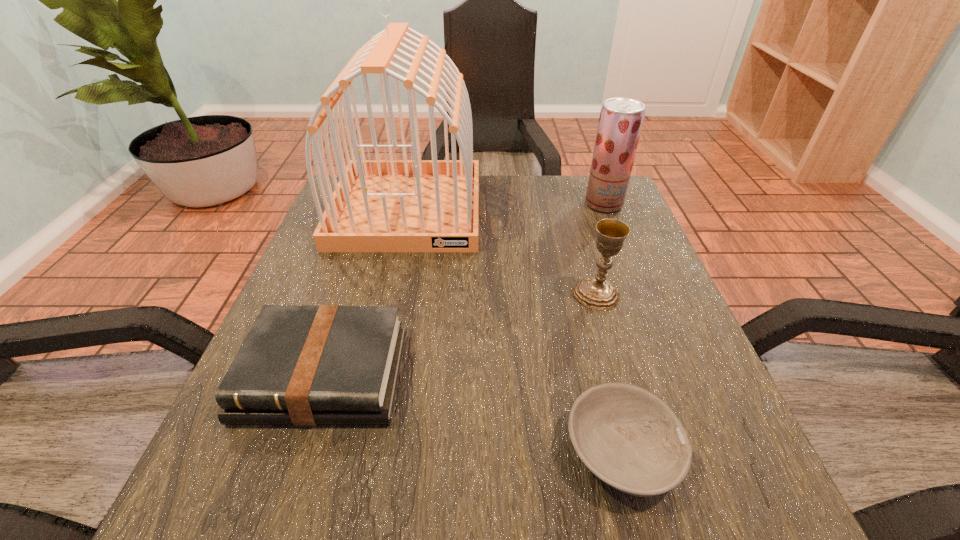
You are a GUI agent. You are given a task and a screenshot of the screen. Output one action in this format:
    pyautogui.click(x=<x>, y=<y>)
    Task: Click on the unoccupied area between the shortest object and the fourth tallest object
    This screenshot has height=540, width=960.
    Given the screenshot: What is the action you would take?
    (x=473, y=413)

Locate an element on the screen. The width and height of the screenshot is (960, 540). free point between the third tallest object and the shortest object is located at coordinates (609, 373).

You are a GUI agent. You are given a task and a screenshot of the screen. Output one action in this format:
    pyautogui.click(x=<x>, y=<y>)
    Task: Click on the vacant area that lies between the tallest object and the chalice
    
    Given the screenshot: What is the action you would take?
    pos(502,251)

At what (x,y) coordinates should I click in order to perform the action: click on free spot between the birdcage and the chalice. Please return your answer as a coordinate pair (x, y). The width and height of the screenshot is (960, 540). Looking at the image, I should click on (502, 251).

Identify the location of free area in between the second shortest object and the fruit juice. (464, 289).

In order to click on empty location between the fruit juice and the bowl in this screenshot , I will do point(612,327).

Locate an element on the screen. free space that is in between the bowl and the third farthest object is located at coordinates (609, 373).

Where is `free spot between the hardback book and the chalice`? free spot between the hardback book and the chalice is located at coordinates (460, 334).

Select which object is the closest to the fourth tallest object. Please provide its 2D coordinates. Your answer should be formatted as a tuple, i.e. [(x, y)], where the tuple contains the x and y coordinates of a point satisfying the conditions above.

[(417, 205)]

Identify which object is the second nearest to the shortest object. Please provide its 2D coordinates. Your answer should be formatted as a tuple, i.e. [(x, y)], where the tuple contains the x and y coordinates of a point satisfying the conditions above.

[(299, 365)]